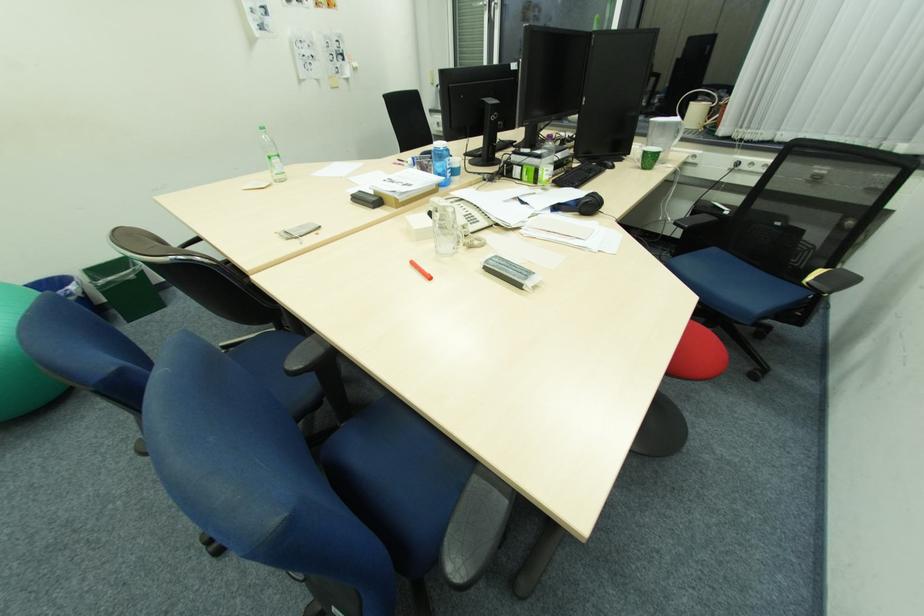
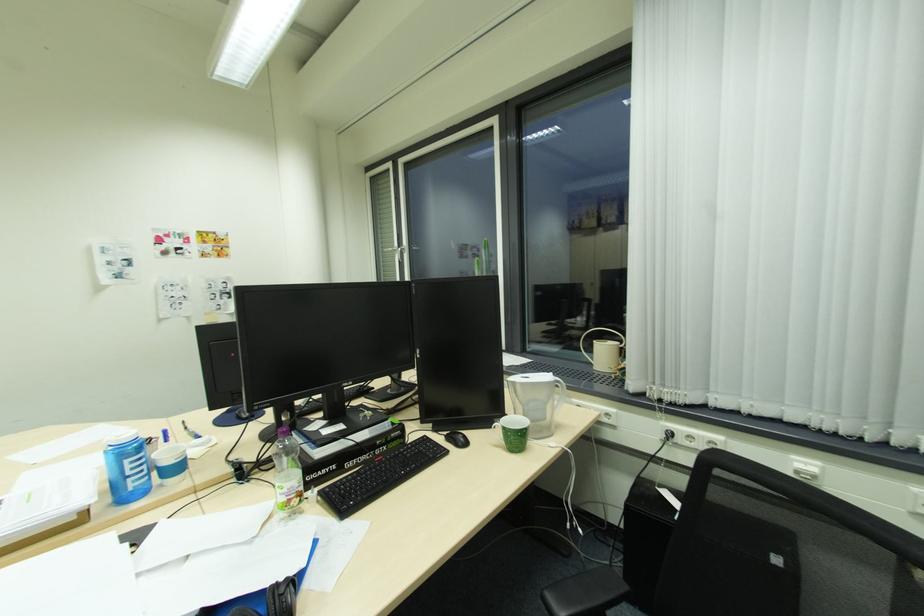
Locate, in the second image, the point that corresponds to point (744, 164) in the first image.

(675, 435)